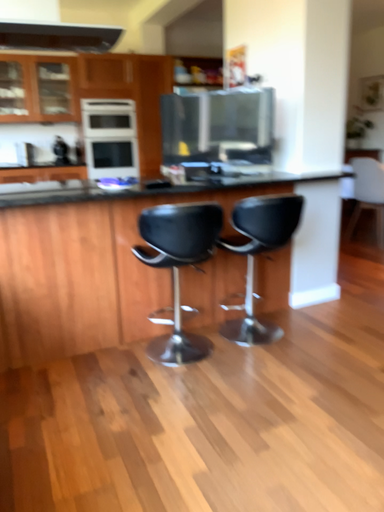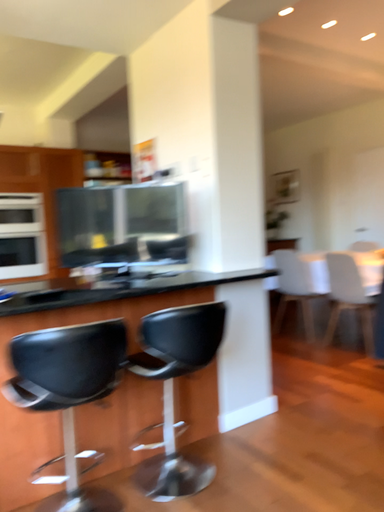
Question: Which way did the camera rotate in the video?

Choices:
 (A) rotated left
 (B) rotated right

Answer: (B)